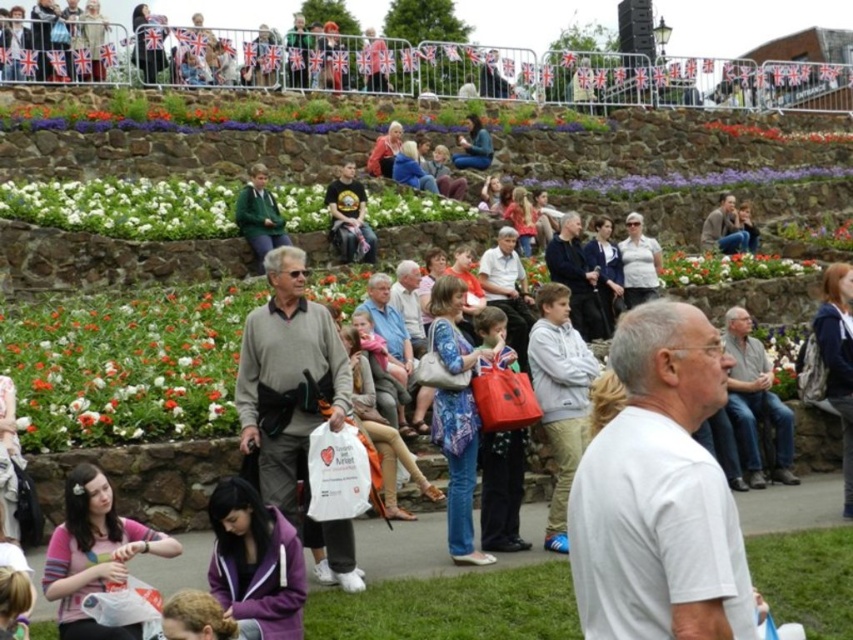
Question: Which point appears closest to the camera in this image?

Choices:
 (A) click(364, 221)
 (B) click(703, 266)
 (C) click(665, 560)
 (D) click(67, 609)

Answer: (C)

Question: Can you confirm if pink fabric shirt at lower left is bigger than green sweater at center?

Choices:
 (A) yes
 (B) no

Answer: (B)

Question: Can you confirm if white cotton shirt at center is positioned above matte black t-shirt at center?

Choices:
 (A) yes
 (B) no

Answer: (B)

Question: Which point is closer to the camera?

Choices:
 (A) (247, 220)
 (B) (335, 230)
 (C) (759, 276)

Answer: (A)

Question: Which object appears farthest from the camera in this image?

Choices:
 (A) green sweater at center
 (B) matte black t-shirt at center
 (C) white cotton shirt at center
 (D) floral fabric flower at center

Answer: (D)

Question: Is matte black t-shirt at center to the right of green sweater at center from the viewer's perspective?

Choices:
 (A) yes
 (B) no

Answer: (A)